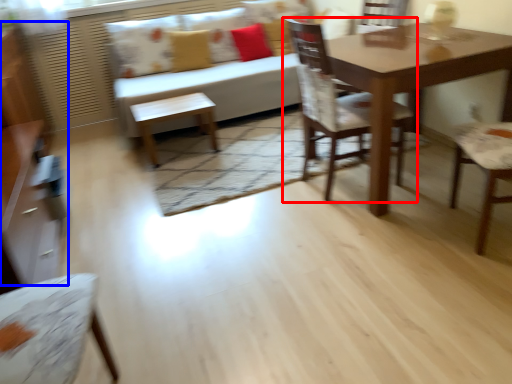
Question: Among these objects, which one is farthest to the camera, chair (highlighted by a red box) or dresser (highlighted by a blue box)?

Choices:
 (A) chair
 (B) dresser

Answer: (B)